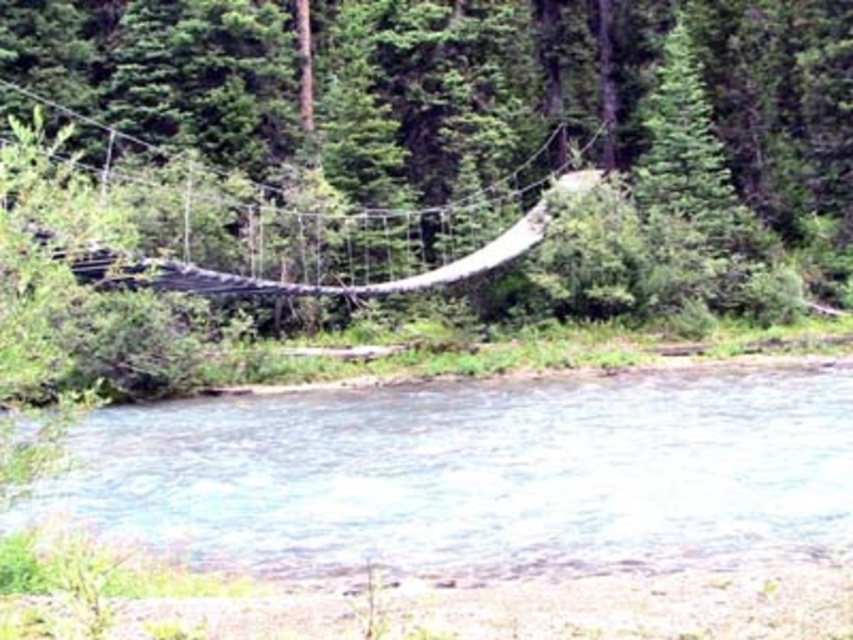
Can you confirm if green leafy tree at center is positioned to the left of clear water at lower center?

Yes, green leafy tree at center is to the left of clear water at lower center.

Is green leafy tree at center wider than clear water at lower center?

Yes, green leafy tree at center is wider than clear water at lower center.

Does point (465, 112) lie behind point (318, 573)?

That is True.

Find the location of a particular element. green leafy tree at center is located at coordinates (457, 129).